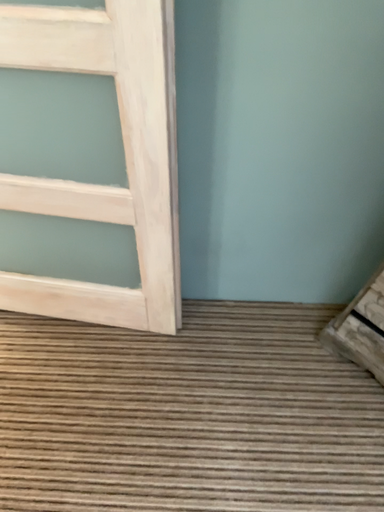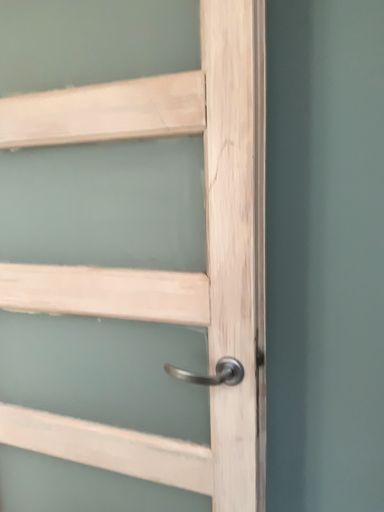
Question: Which way did the camera rotate in the video?

Choices:
 (A) rotated downward
 (B) rotated upward

Answer: (B)